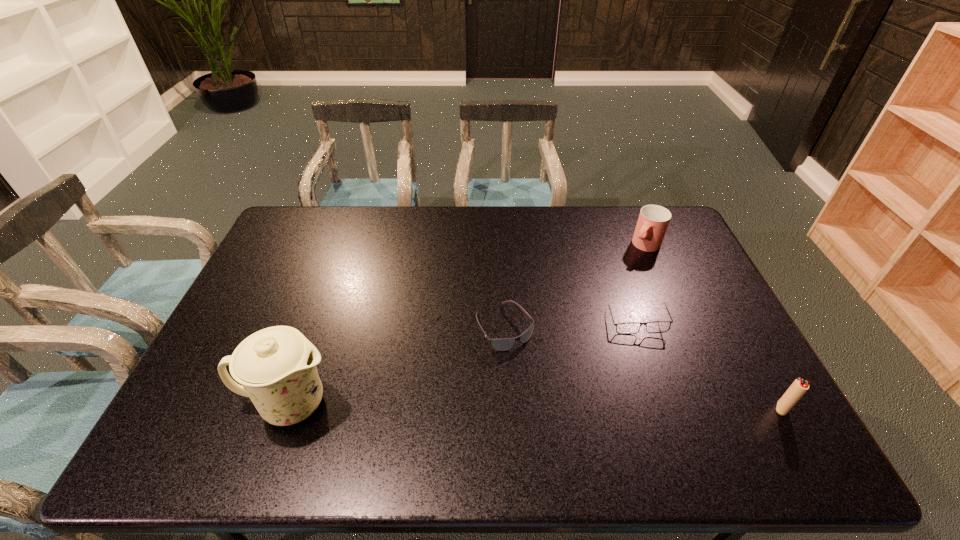
Identify the location of the tallest object. This screenshot has height=540, width=960. (276, 366).

I want to click on chinaware, so click(x=276, y=366).

This screenshot has height=540, width=960. I want to click on the rightmost object, so click(x=798, y=388).

This screenshot has height=540, width=960. Find the location of `spectacles`. spectacles is located at coordinates (628, 328).

Find the location of a particular element. The height and width of the screenshot is (540, 960). the farthest object is located at coordinates (653, 220).

Locate an element on the screen. The height and width of the screenshot is (540, 960). the second object from left to right is located at coordinates (501, 344).

At what (x,y) coordinates should I click in order to perform the action: click on vacant space located 0.180m on the spout of the chinaware. Please return your answer as a coordinate pair (x, y). Looking at the image, I should click on (410, 403).

This screenshot has height=540, width=960. What are the coordinates of `free region located on the back of the igniter` in the screenshot? It's located at (721, 300).

Identify the location of vacant space located with the lenses facing outward on the spectacles. (601, 396).

Identify the location of blank area located 0.060m with the lenses facing outward on the spectacles. This screenshot has height=540, width=960. (620, 349).